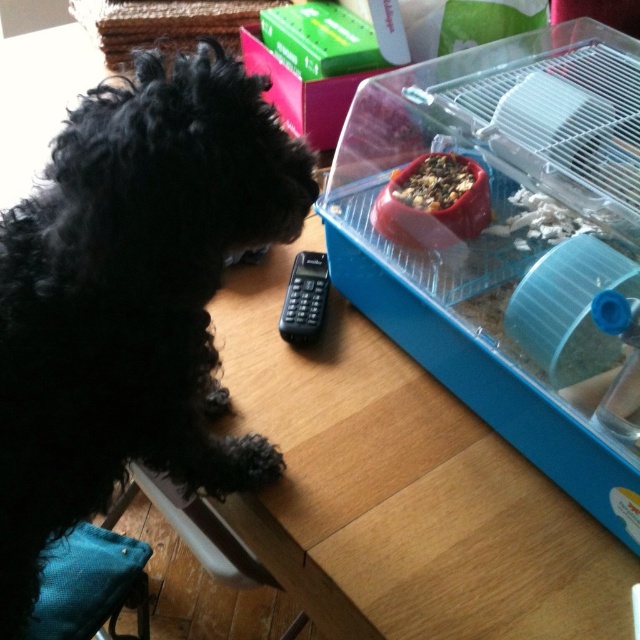
You are a photographer trying to capture a closeup of the wooden table at lower left. Your camera has a minimum focusing distance of 25 inches. Can you take the photo without moving either the camera or the table?

The wooden table at lower left and camera are 27.10 inches apart. Since the minimum focusing distance is 25 inches, the camera can focus on the wooden table at lower left as it is within range.

You are standing in front of the table where the black dog is sitting. You want to place a small toy exactly at the point marked as point (291, 365) on the table. How far will this toy be from your eyes?

The distance of point (291, 365) from viewer is 95.14 centimeters, so the toy will be 95.14 centimeters away from your eyes.